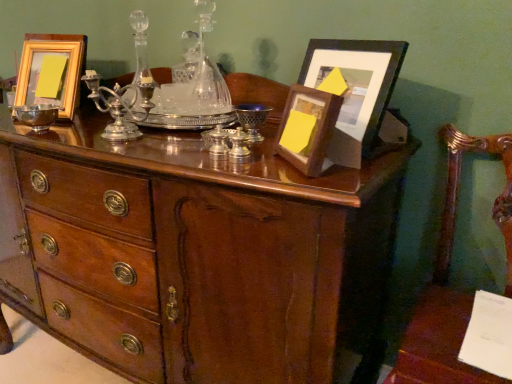
I want to click on vacant area that lies between silver metallic candle holder at center, marked as the 2th candle holder in a right-to-left arrangement, and silver polished candle holder at center, acting as the 3th candle holder starting from the right, so click(x=175, y=148).